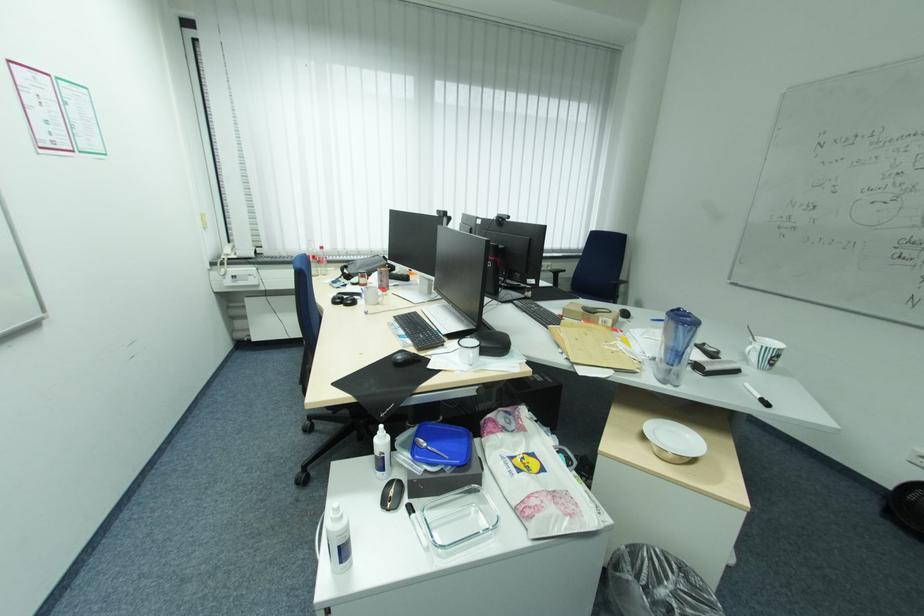
I want to click on white marker, so click(757, 395).